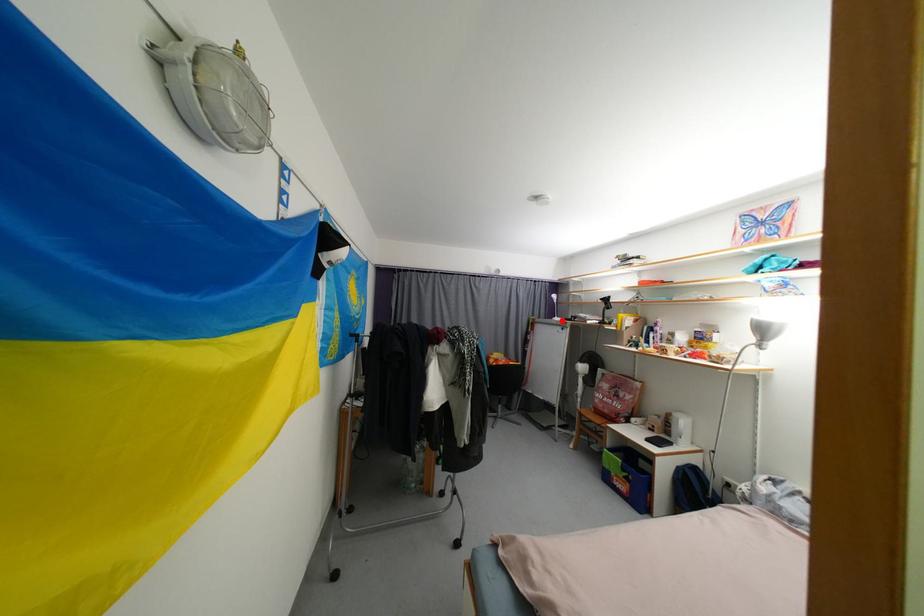
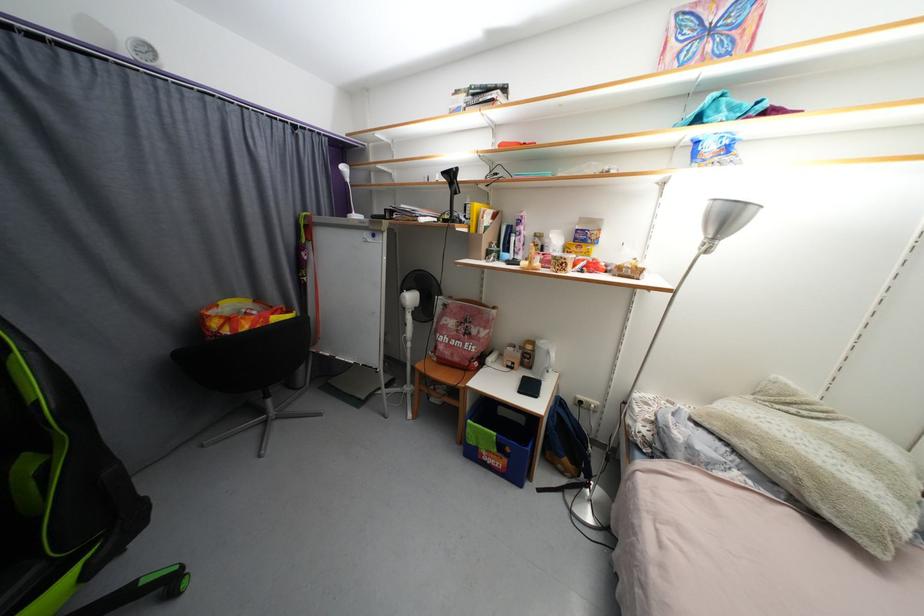
Locate, in the second image, the point that corresponds to the highlighted location in the first image.

(360, 217)